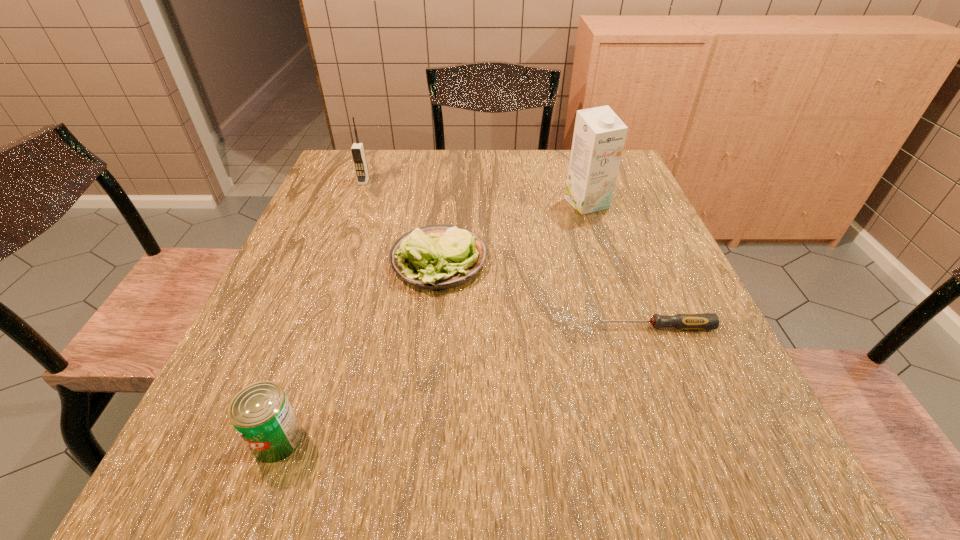
Locate an element on the screen. Image resolution: width=960 pixels, height=540 pixels. carton is located at coordinates (599, 135).

The width and height of the screenshot is (960, 540). Find the location of `the fourth nearest object`. the fourth nearest object is located at coordinates (599, 135).

The image size is (960, 540). I want to click on the farthest object, so (357, 150).

This screenshot has width=960, height=540. I want to click on cellular telephone, so click(357, 150).

Where is `the third tallest object`? The width and height of the screenshot is (960, 540). the third tallest object is located at coordinates (261, 413).

The image size is (960, 540). Find the location of `can`. can is located at coordinates (261, 413).

This screenshot has width=960, height=540. What are the coordinates of `the third object from left to right` in the screenshot? It's located at [435, 257].

The width and height of the screenshot is (960, 540). Find the location of `the third farthest object`. the third farthest object is located at coordinates (435, 257).

Where is `screwdriver`? screwdriver is located at coordinates (685, 321).

Find the location of a particular element. the fourth farthest object is located at coordinates (685, 321).